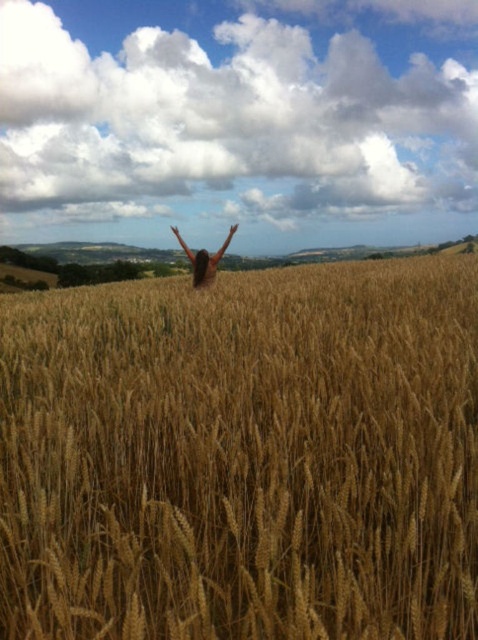
You are standing at the point labeled as point (242, 456) in the image. Looking around, you see the golden wheat field at center. What is directly beneath your feet?

The point (242, 456) indicates the golden wheat field at center, so the ground beneath your feet is part of the golden wheat field at center.